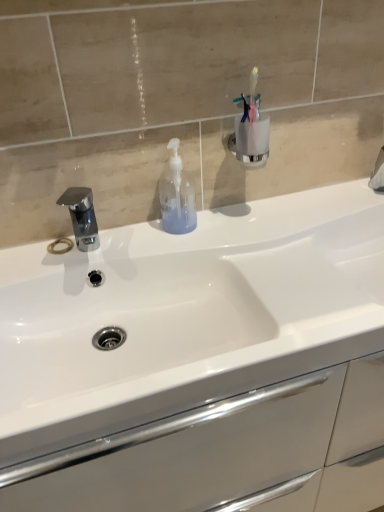
You are a GUI agent. You are given a task and a screenshot of the screen. Output one action in this format:
    pyautogui.click(x=<x>, y=<y>)
    Task: Click on the free location to the left of chrome metallic faucet at left
    This screenshot has width=384, height=512.
    Given the screenshot: What is the action you would take?
    pyautogui.click(x=34, y=265)